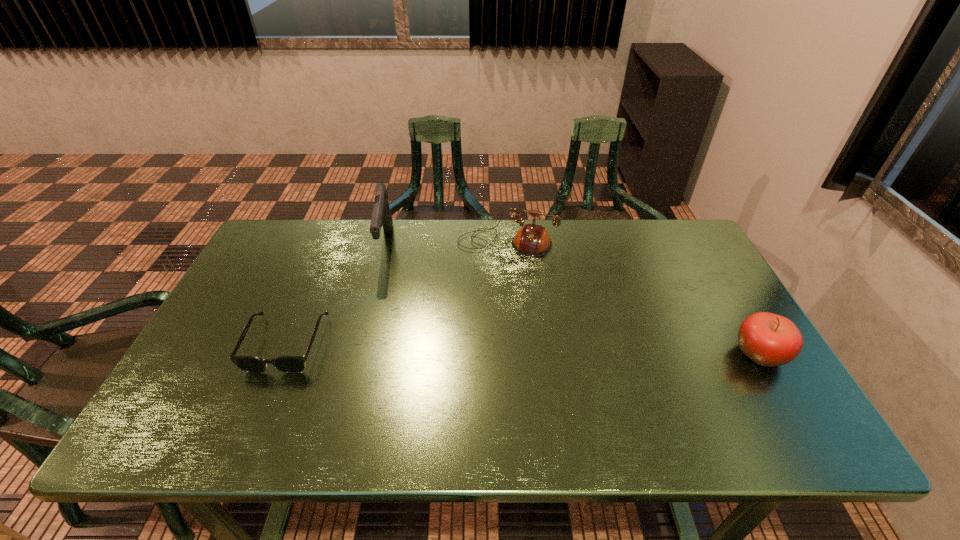
In order to click on vacant space at the far edge of the desktop in this screenshot , I will do `click(433, 245)`.

You are a GUI agent. You are given a task and a screenshot of the screen. Output one action in this format:
    pyautogui.click(x=<x>, y=<y>)
    Task: Click on the vacant space at the right edge of the desktop
    
    Given the screenshot: What is the action you would take?
    pyautogui.click(x=677, y=305)

Find the location of a particular element. The width and height of the screenshot is (960, 540). vacant area at the far left corner is located at coordinates (291, 245).

This screenshot has width=960, height=540. In order to click on vacant space at the near left corner of the desktop in this screenshot , I will do `click(199, 398)`.

Find the location of `free spot at the far right corner of the desktop`. free spot at the far right corner of the desktop is located at coordinates (650, 232).

Identify the location of vacant region at the near right corner. (755, 402).

Where is `empty space between the apple and the gun`? empty space between the apple and the gun is located at coordinates (573, 299).

Where is `vacant space in between the rightmost object and the gun`? vacant space in between the rightmost object and the gun is located at coordinates (573, 299).

The image size is (960, 540). Find the location of `unoccupied area between the leftmost object and the gun`. unoccupied area between the leftmost object and the gun is located at coordinates (336, 294).

I want to click on vacant area that lies between the rightmost object and the telephone, so click(634, 300).